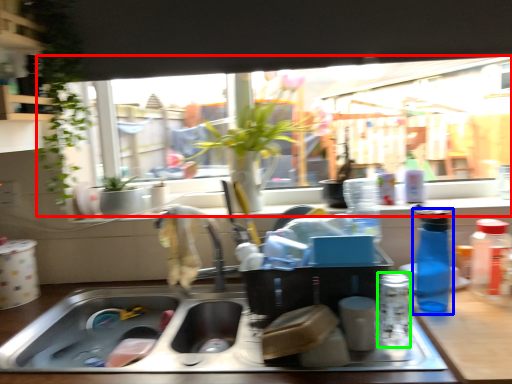
Question: Which object is the farthest from window (highlighted by a red box)? Choose among these: bottle (highlighted by a blue box) or bottle (highlighted by a green box).

Choices:
 (A) bottle
 (B) bottle

Answer: (B)